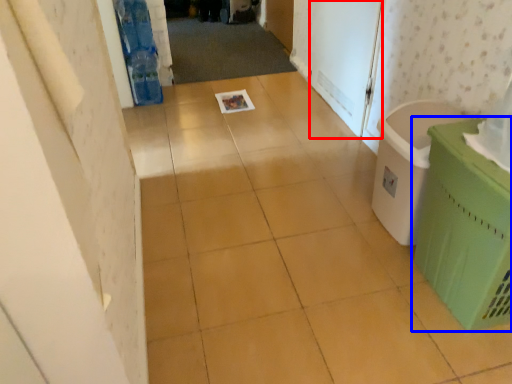
Question: Which object is further to the camera taking this photo, screen door (highlighted by a red box) or waste container (highlighted by a blue box)?

Choices:
 (A) screen door
 (B) waste container

Answer: (A)